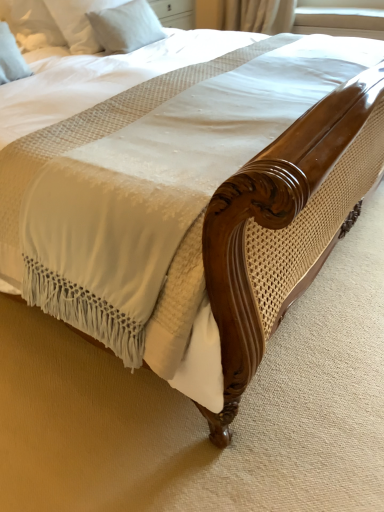
Question: Is white soft pillow at upper left, marked as the 2th pillow in a left-to-right arrangement, next to white soft pillow at upper left, marked as the first pillow in a front-to-back arrangement?

Choices:
 (A) no
 (B) yes

Answer: (A)

Question: From a real-world perspective, does white soft pillow at upper left, acting as the first pillow starting from the right, stand above white soft pillow at upper left, placed as the 2th pillow when sorted from back to front?

Choices:
 (A) no
 (B) yes

Answer: (A)

Question: From a real-world perspective, is white soft pillow at upper left, the first pillow from the back, under white soft pillow at upper left, positioned as the 1th pillow in left-to-right order?

Choices:
 (A) no
 (B) yes

Answer: (B)

Question: From the image's perspective, does white soft pillow at upper left, marked as the 2th pillow in a left-to-right arrangement, appear higher than white soft pillow at upper left, marked as the first pillow in a front-to-back arrangement?

Choices:
 (A) yes
 (B) no

Answer: (A)

Question: Is white soft pillow at upper left, marked as the first pillow in a front-to-back arrangement, located within white soft pillow at upper left, marked as the 2th pillow in a left-to-right arrangement?

Choices:
 (A) yes
 (B) no

Answer: (B)

Question: Is white soft pillow at upper left, which is the 2th pillow in front-to-back order, at the right side of white soft pillow at upper left, positioned as the 2th pillow in right-to-left order?

Choices:
 (A) no
 (B) yes

Answer: (B)

Question: Considering the relative positions of white soft pillow at upper left, positioned as the 1th pillow in left-to-right order, and white soft pillow at upper left, acting as the first pillow starting from the right, in the image provided, is white soft pillow at upper left, positioned as the 1th pillow in left-to-right order, to the right of white soft pillow at upper left, acting as the first pillow starting from the right, from the viewer's perspective?

Choices:
 (A) yes
 (B) no

Answer: (B)

Question: From a real-world perspective, is white soft pillow at upper left, positioned as the 2th pillow in right-to-left order, on top of white soft pillow at upper left, acting as the first pillow starting from the right?

Choices:
 (A) yes
 (B) no

Answer: (A)

Question: Does white soft pillow at upper left, positioned as the 1th pillow in left-to-right order, appear on the left side of white soft pillow at upper left, acting as the first pillow starting from the right?

Choices:
 (A) no
 (B) yes

Answer: (B)

Question: Is the depth of white soft pillow at upper left, positioned as the 1th pillow in left-to-right order, greater than that of white soft pillow at upper left, marked as the 2th pillow in a left-to-right arrangement?

Choices:
 (A) no
 (B) yes

Answer: (A)

Question: Does white soft pillow at upper left, placed as the 2th pillow when sorted from back to front, lie in front of white soft pillow at upper left, marked as the 2th pillow in a left-to-right arrangement?

Choices:
 (A) no
 (B) yes

Answer: (B)

Question: Can you confirm if white soft pillow at upper left, positioned as the 1th pillow in left-to-right order, is shorter than white soft pillow at upper left, the first pillow from the back?

Choices:
 (A) yes
 (B) no

Answer: (B)

Question: Is white soft pillow at upper left, the first pillow from the back, turned away from white fabric at upper right?

Choices:
 (A) yes
 (B) no

Answer: (B)